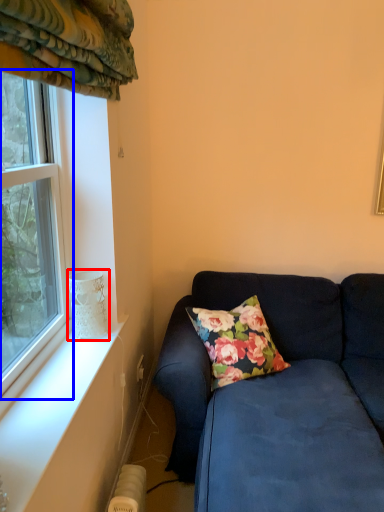
Question: Which of the following is the farthest to the observer, glass vase (highlighted by a red box) or window (highlighted by a blue box)?

Choices:
 (A) glass vase
 (B) window

Answer: (A)